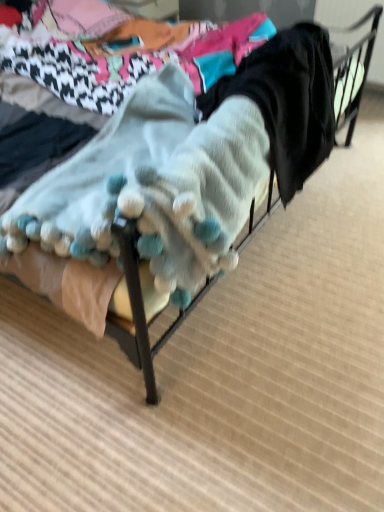
Question: In the image, is fuzzy white blanket at center on the left side or the right side of knitted wool socks at center?

Choices:
 (A) right
 (B) left

Answer: (B)

Question: In the image, is fuzzy white blanket at center positioned in front of or behind knitted wool socks at center?

Choices:
 (A) front
 (B) behind

Answer: (A)

Question: Is fuzzy white blanket at center taller or shorter than knitted wool socks at center?

Choices:
 (A) tall
 (B) short

Answer: (B)

Question: Considering the relative positions of knitted wool socks at center and fuzzy white blanket at center in the image provided, is knitted wool socks at center to the left or to the right of fuzzy white blanket at center?

Choices:
 (A) right
 (B) left

Answer: (A)

Question: In terms of height, does knitted wool socks at center look taller or shorter compared to fuzzy white blanket at center?

Choices:
 (A) tall
 (B) short

Answer: (A)

Question: From a real-world perspective, is knitted wool socks at center physically located above or below fuzzy white blanket at center?

Choices:
 (A) below
 (B) above

Answer: (B)

Question: In the image, is knitted wool socks at center positioned in front of or behind fuzzy white blanket at center?

Choices:
 (A) front
 (B) behind

Answer: (B)